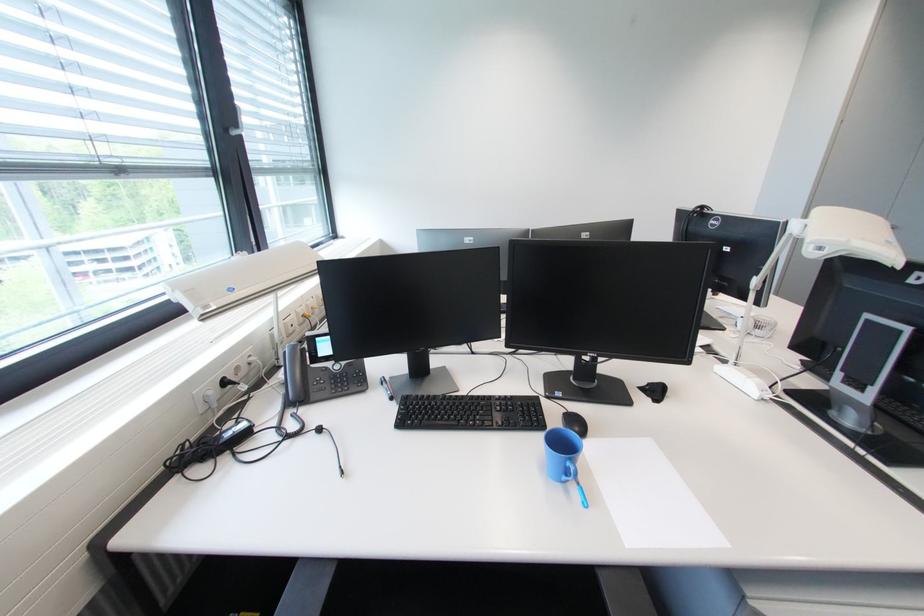
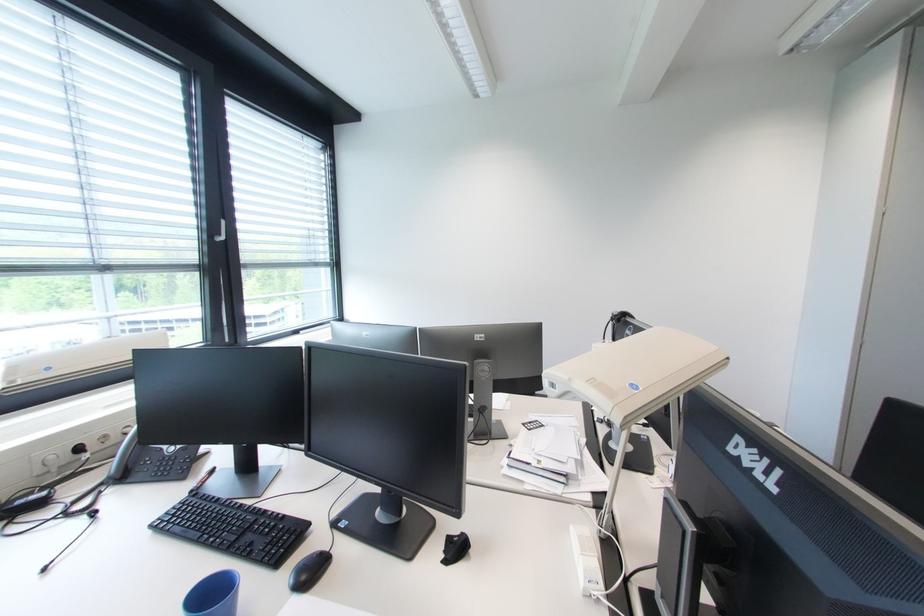
Where in the second image is the point corresponding to point (256, 358) from the first image?

(134, 428)